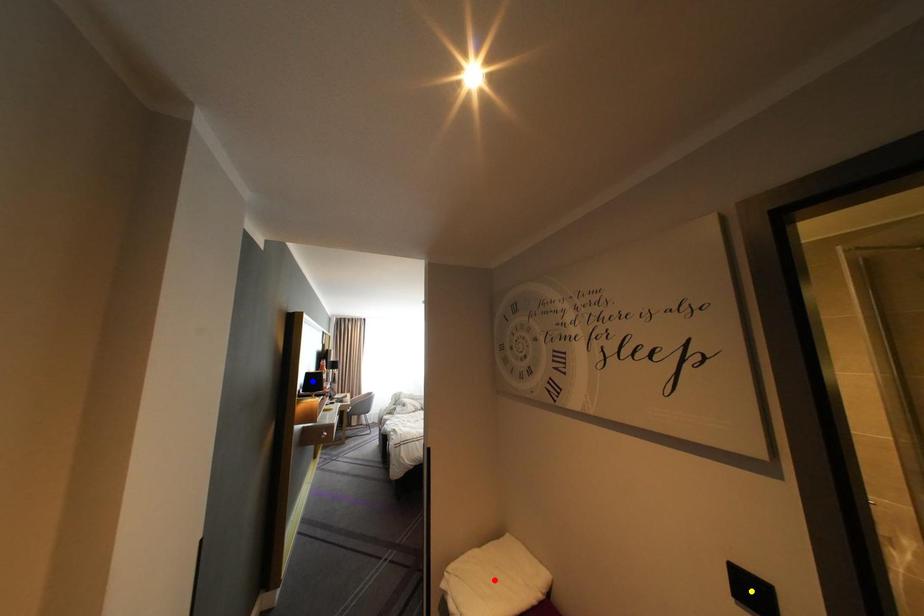
Order these from nearest to farthest:
1. red point
2. yellow point
3. blue point

blue point < red point < yellow point